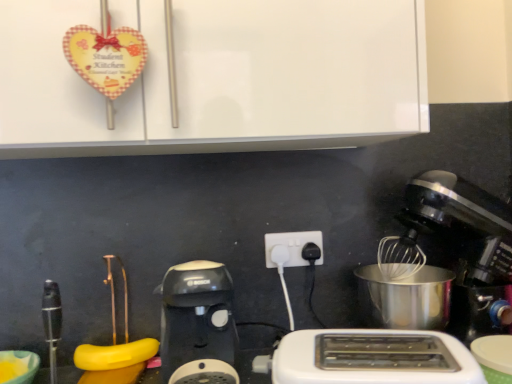
Find the location of a particular element. white plastic power plug at center is located at coordinates (293, 246).

Identify the location of black plastic coffee maker at center. (198, 324).

What do you see at coordinates (369, 358) in the screenshot?
I see `white plastic toaster at lower center` at bounding box center [369, 358].

Image resolution: width=512 pixels, height=384 pixels. Identify the location of metallic silver mixer at right. (443, 269).

Locate an element on the screen. white glossy cabinet at upper center is located at coordinates (220, 78).

Describe the element at coordinates (220, 78) in the screenshot. Image resolution: width=512 pixels, height=384 pixels. I see `white glossy cabinet at upper center` at that location.

This screenshot has width=512, height=384. What do you see at coordinates (18, 366) in the screenshot?
I see `matte yellow bowl at lower left` at bounding box center [18, 366].

Find the location of a particular element. The width and height of the screenshot is (512, 384). white plastic power plug at center is located at coordinates (293, 246).

Which object is wider, black plastic coffee maker at center or white plastic toaster at lower center?

black plastic coffee maker at center.

Is black plastic coffee maker at center facing away from white plastic toaster at lower center?

No, black plastic coffee maker at center is not facing away from white plastic toaster at lower center.

From a real-world perspective, between black plastic coffee maker at center and white plastic toaster at lower center, who is vertically lower?

black plastic coffee maker at center is physically lower.

Who is shorter, black plastic coffee maker at center or white plastic toaster at lower center?

With less height is white plastic toaster at lower center.

Locate an element on the screen. The height and width of the screenshot is (384, 512). mixer below the white glossy cabinet at upper center (from a real-world perspective) is located at coordinates (443, 269).

Can you confirm if metallic silver mixer at right is positioned to the right of white glossy cabinet at upper center?

Yes, metallic silver mixer at right is to the right of white glossy cabinet at upper center.

Which is in front, point (456, 211) or point (97, 152)?

The point (456, 211) is more forward.

Is metallic silver mixer at right far away from white glossy cabinet at upper center?

No, metallic silver mixer at right is in close proximity to white glossy cabinet at upper center.

Based on the photo, is metallic silver mixer at right next to matte yellow bowl at lower left?

No, metallic silver mixer at right is not with matte yellow bowl at lower left.

Which is behind, point (449, 329) or point (24, 378)?

Point (449, 329)

From a real-world perspective, between metallic silver mixer at right and matte yellow bowl at lower left, who is vertically lower?

matte yellow bowl at lower left is physically lower.

Between white plastic toaster at lower center and white plastic power plug at center, which one has larger size?

With larger size is white plastic toaster at lower center.

Does white plastic toaster at lower center appear on the right side of white plastic power plug at center?

Yes, white plastic toaster at lower center is to the right of white plastic power plug at center.

From the image's perspective, is white plastic toaster at lower center located above or below white plastic power plug at center?

white plastic toaster at lower center is situated lower than white plastic power plug at center in the image.

Does white plastic toaster at lower center lie behind white plastic power plug at center?

No, it is not.

Does white plastic power plug at center turn towards white glossy cabinet at upper center?

No, white plastic power plug at center does not turn towards white glossy cabinet at upper center.

From the image's perspective, is white plastic power plug at center located above or below white glossy cabinet at upper center?

Clearly, from the image's perspective, white plastic power plug at center is below white glossy cabinet at upper center.

Between white plastic power plug at center and white glossy cabinet at upper center, which one appears on the left side from the viewer's perspective?

From the viewer's perspective, white glossy cabinet at upper center appears more on the left side.

Is white plastic power plug at center positioned behind white glossy cabinet at upper center?

That is True.

Is metallic silver mixer at right in front of or behind white plastic power plug at center in the image?

metallic silver mixer at right is in front of white plastic power plug at center.

Choose the correct answer: Is metallic silver mixer at right inside white plastic power plug at center or outside it?

metallic silver mixer at right is not inside white plastic power plug at center, it's outside.

Consider the image. Is metallic silver mixer at right facing away from white plastic power plug at center?

No, metallic silver mixer at right is not facing away from white plastic power plug at center.

Locate an element on the screen. The width and height of the screenshot is (512, 384). mixer below the white plastic power plug at center (from the image's perspective) is located at coordinates (443, 269).

Is black plastic coffee maker at center facing towards matte yellow bowl at lower left?

No.

How distant is black plastic coffee maker at center from matte yellow bowl at lower left?

black plastic coffee maker at center and matte yellow bowl at lower left are 35.47 centimeters apart.

Based on the photo, which is farther, [197,332] or [10,362]?

The point [10,362] is more distant.

Is the position of black plastic coffee maker at center less distant than that of matte yellow bowl at lower left?

Yes, black plastic coffee maker at center is closer to the viewer.

The image size is (512, 384). Find the location of `toaster that is in front of the black plastic coffee maker at center`. toaster that is in front of the black plastic coffee maker at center is located at coordinates (369, 358).

Locate an element on the screen. mixer below the white glossy cabinet at upper center (from a real-world perspective) is located at coordinates (443, 269).

From the image, which object appears to be farther from black plastic coffee maker at center, white plastic toaster at lower center or metallic silver mixer at right?

Among the two, metallic silver mixer at right is located further to black plastic coffee maker at center.

Based on their spatial positions, is black plastic coffee maker at center or metallic silver mixer at right further from matte yellow bowl at lower left?

metallic silver mixer at right is positioned further to the anchor matte yellow bowl at lower left.

From the image, which object appears to be farther from black plastic coffee maker at center, metallic silver mixer at right or white plastic power plug at center?

The object further to black plastic coffee maker at center is metallic silver mixer at right.

Which object lies nearer to the anchor point metallic silver mixer at right, matte yellow bowl at lower left or white glossy cabinet at upper center?

white glossy cabinet at upper center lies closer to metallic silver mixer at right than the other object.

In the scene shown: When comparing their distances from metallic silver mixer at right, does white glossy cabinet at upper center or black plastic coffee maker at center seem further?

black plastic coffee maker at center.

Looking at the image, which one is located further to white glossy cabinet at upper center, matte yellow bowl at lower left or black plastic coffee maker at center?

The object further to white glossy cabinet at upper center is matte yellow bowl at lower left.

When comparing their distances from white plastic power plug at center, does black plastic coffee maker at center or metallic silver mixer at right seem closer?

Based on the image, black plastic coffee maker at center appears to be nearer to white plastic power plug at center.

Consider the image. When comparing their distances from matte yellow bowl at lower left, does white plastic toaster at lower center or metallic silver mixer at right seem closer?

The object closer to matte yellow bowl at lower left is white plastic toaster at lower center.

Locate an element on the screen. coffee maker between white glossy cabinet at upper center and matte yellow bowl at lower left in the vertical direction is located at coordinates (198, 324).

This screenshot has height=384, width=512. I want to click on power plugs and sockets between matte yellow bowl at lower left and metallic silver mixer at right in the horizontal direction, so click(x=293, y=246).

This screenshot has width=512, height=384. I want to click on mixer located between white plastic toaster at lower center and white plastic power plug at center in the depth direction, so click(443, 269).

Identify the location of power plugs and sockets between white glossy cabinet at upper center and black plastic coffee maker at center from top to bottom. (293, 246).